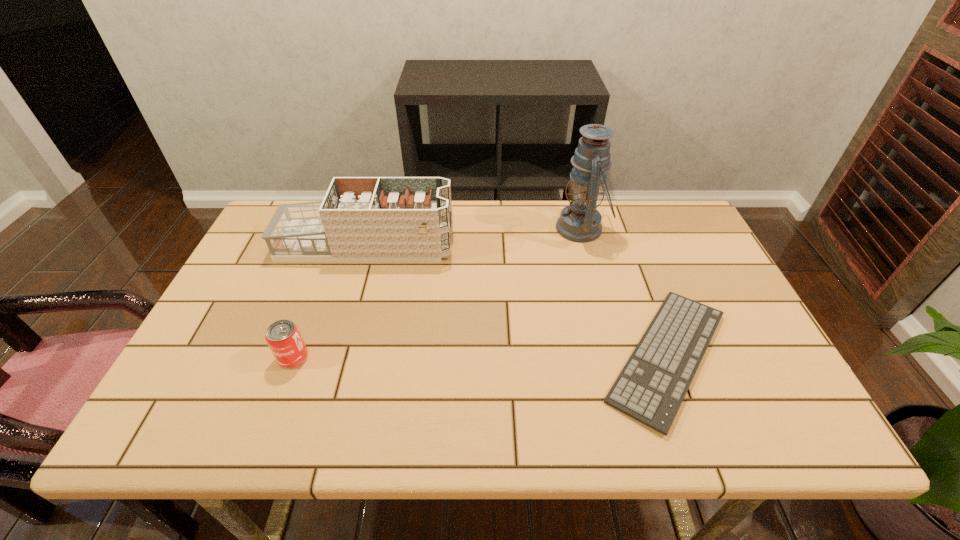
Locate an element on the screen. The width and height of the screenshot is (960, 540). free region at the right edge is located at coordinates (731, 320).

Identify the location of vacant area that lies between the can and the lantern. The image size is (960, 540). (438, 293).

Image resolution: width=960 pixels, height=540 pixels. I want to click on vacant point located between the computer keyboard and the lantern, so click(624, 292).

Locate an element on the screen. vacant space that's between the shortest object and the lantern is located at coordinates (624, 292).

Identify the location of free area in between the lantern and the shortest object. coord(624,292).

What are the coordinates of `vacant space that is in between the shortest object and the dollhouse` in the screenshot? It's located at (516, 300).

Find the location of `vacant region between the shortest object and the third tallest object`. vacant region between the shortest object and the third tallest object is located at coordinates (480, 356).

Image resolution: width=960 pixels, height=540 pixels. What are the coordinates of `free space between the third tallest object and the shortest object` in the screenshot? It's located at (480, 356).

Find the location of a particular element. This screenshot has height=540, width=960. free spot between the third shortest object and the tallest object is located at coordinates (473, 237).

Identify the location of vacant area that lies between the can and the shortest object. (480, 356).